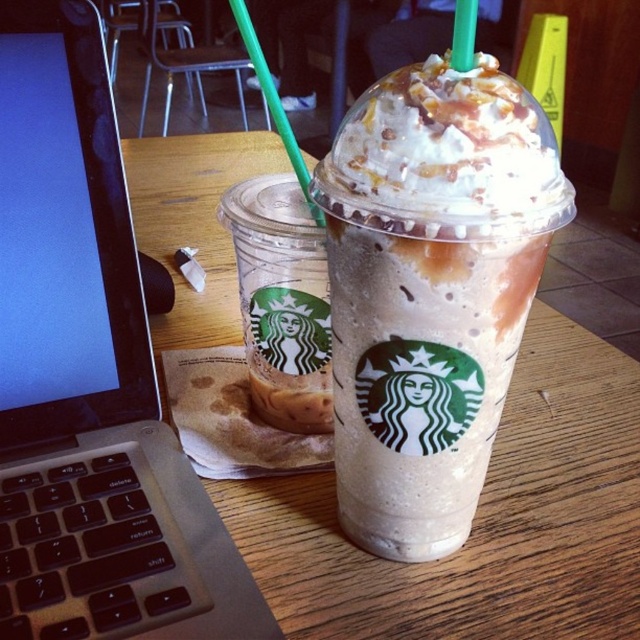
Does point (81, 305) come in front of point (372, 188)?

No.

Is black plastic laptop at left above whipped cream topped caramel frappuccino at center?

Correct, black plastic laptop at left is located above whipped cream topped caramel frappuccino at center.

Locate an element on the screen. This screenshot has height=640, width=640. black plastic laptop at left is located at coordinates (90, 376).

Does translucent plastic cup at left have a lesser width compared to green plastic straw at upper center?

Correct, translucent plastic cup at left's width is less than green plastic straw at upper center's.

Who is more forward, (262, 268) or (259, 83)?

Point (262, 268)

Who is more distant from viewer, (316, 365) or (260, 72)?

Positioned behind is point (316, 365).

Find the location of a particular element. This screenshot has width=640, height=640. translucent plastic cup at left is located at coordinates (x=282, y=300).

Between wooden table at center and whipped cream topped caramel frappuccino at center, which one has less height?

Standing shorter between the two is whipped cream topped caramel frappuccino at center.

Who is positioned more to the left, wooden table at center or whipped cream topped caramel frappuccino at center?

Positioned to the left is wooden table at center.

The height and width of the screenshot is (640, 640). Identify the location of wooden table at center. (481, 520).